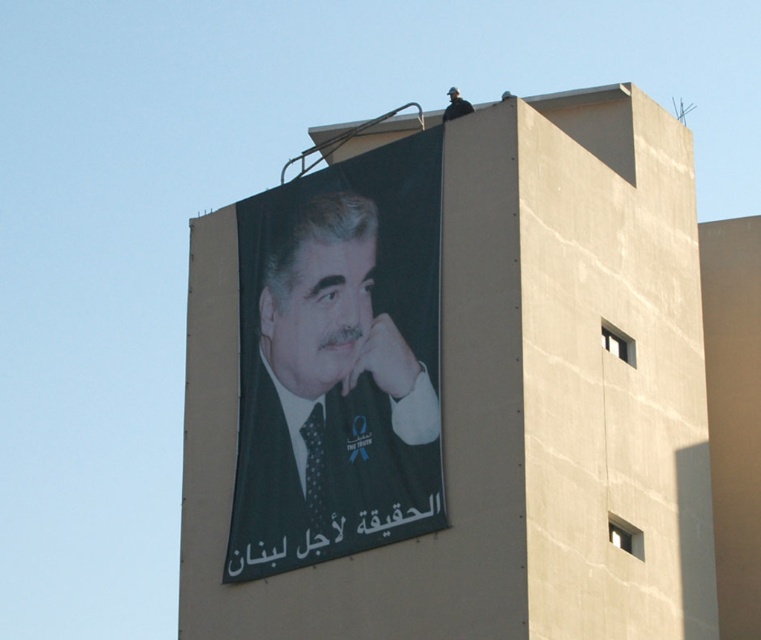
Can you confirm if dark green matte poster at upper center is positioned above matte black jaw at upper center?

Incorrect, dark green matte poster at upper center is not positioned above matte black jaw at upper center.

Is dark green matte poster at upper center to the right of matte black jaw at upper center from the viewer's perspective?

Incorrect, dark green matte poster at upper center is not on the right side of matte black jaw at upper center.

The image size is (761, 640). What do you see at coordinates (338, 362) in the screenshot?
I see `dark green matte poster at upper center` at bounding box center [338, 362].

Locate an element on the screen. This screenshot has width=761, height=640. dark green matte poster at upper center is located at coordinates (338, 362).